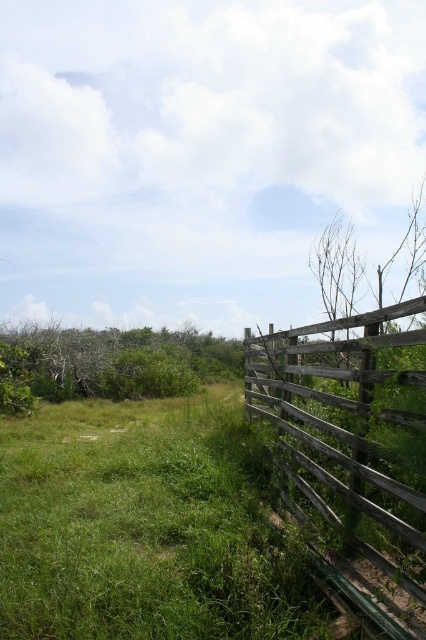
Question: Observing the image, what is the correct spatial positioning of weathered wood fence at right in reference to green leafy bush at left?

Choices:
 (A) above
 (B) below

Answer: (A)

Question: Does weathered wood fence at right have a greater width compared to green leafy bush at left?

Choices:
 (A) no
 (B) yes

Answer: (A)

Question: Is weathered wood fence at right closer to the viewer compared to green leafy bush at left?

Choices:
 (A) no
 (B) yes

Answer: (B)